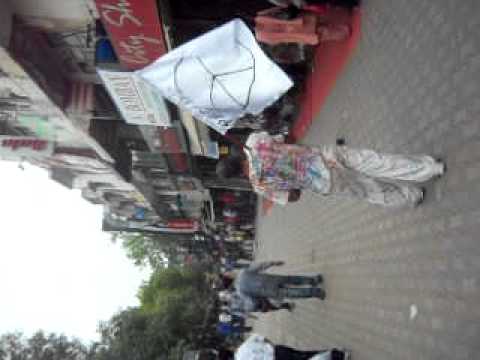
You are a GUI agent. You are given a task and a screenshot of the screen. Output one action in this format:
    pyautogui.click(x=<x>, y=<y>)
    Task: Click on the window
    This screenshot has height=360, width=480.
    Given the screenshot: What is the action you would take?
    pyautogui.click(x=162, y=174)